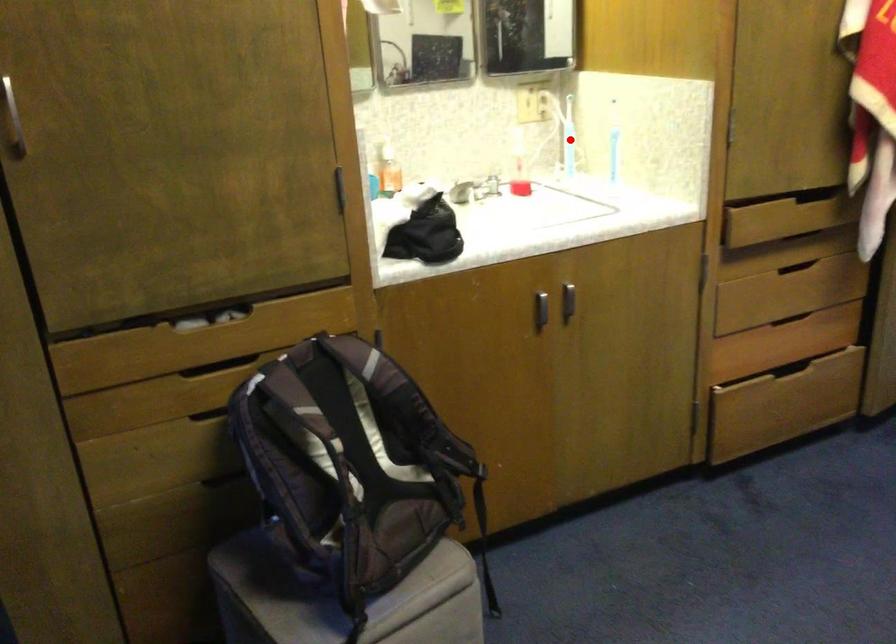
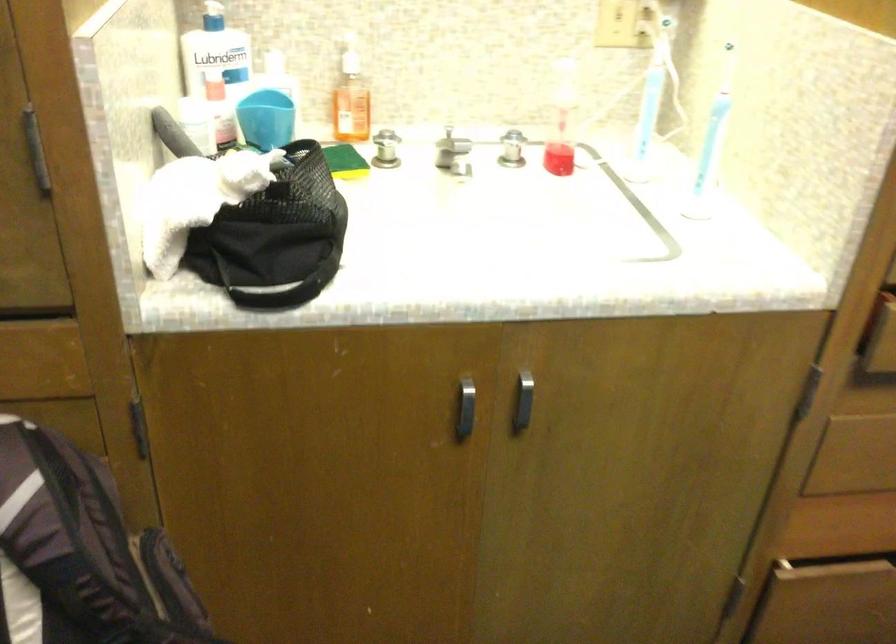
The point at the highlighted location is marked in the first image. Where is the corresponding point in the second image?

(650, 102)